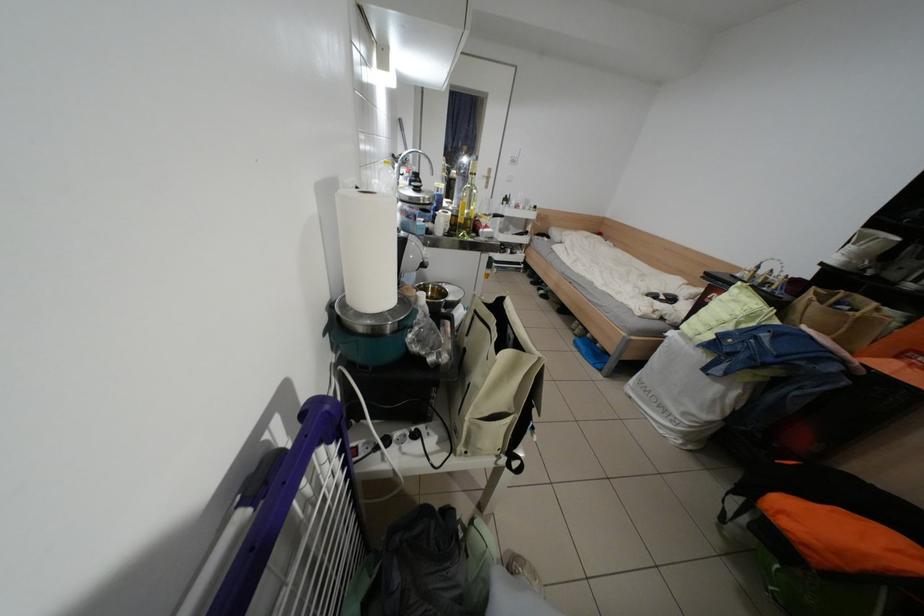
Find where to lift the metal bowl. Please return your answer as a coordinate pair (x, y).

(433, 294)